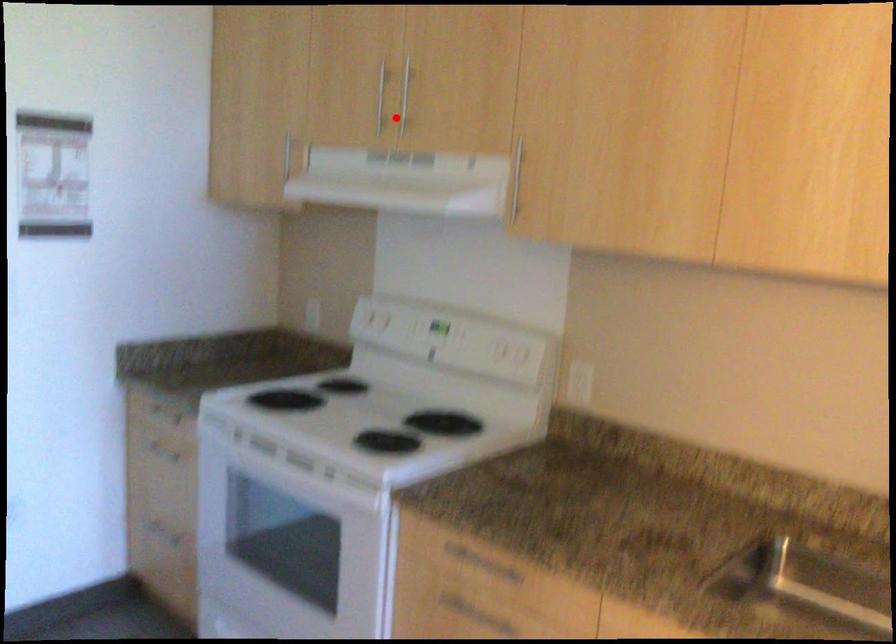
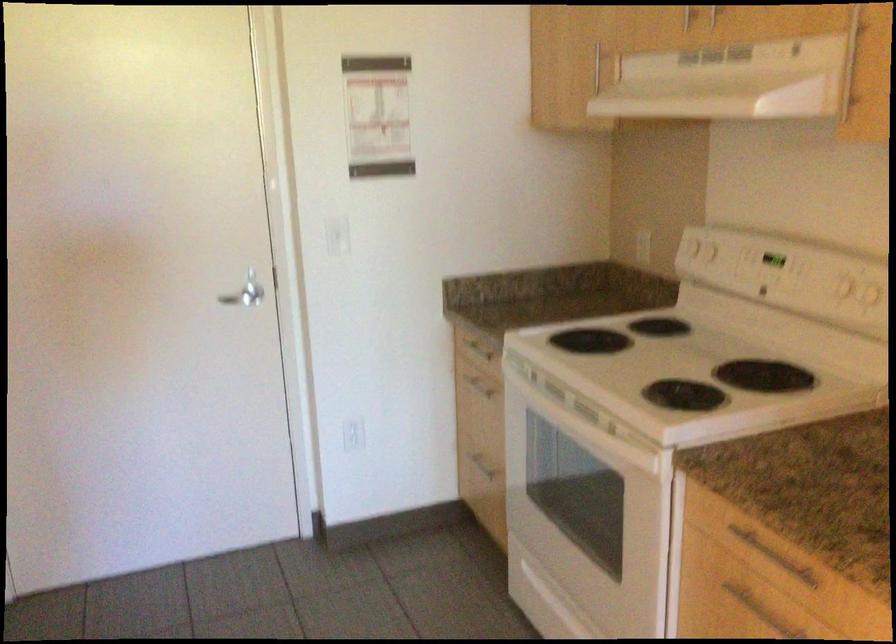
Find the pixel in the second image that matches the highlighted location in the first image.

(714, 15)